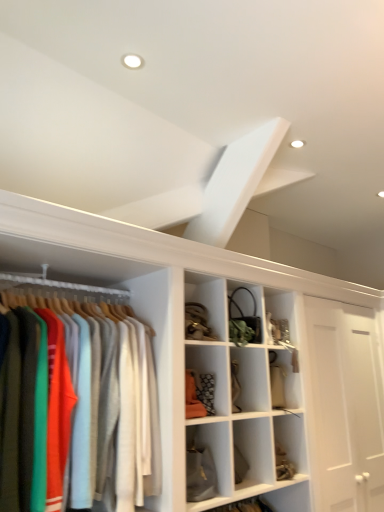
Find the location of a particular element. This screenshot has width=384, height=512. matte cotton shirts at left is located at coordinates (77, 406).

The width and height of the screenshot is (384, 512). Describe the element at coordinates (77, 406) in the screenshot. I see `matte cotton shirts at left` at that location.

What do you see at coordinates (235, 183) in the screenshot? I see `white matte exhaust hood at upper center` at bounding box center [235, 183].

Find the location of `white matte exhaust hood at upper center`. white matte exhaust hood at upper center is located at coordinates (235, 183).

You are a GUI agent. You are given a task and a screenshot of the screen. Output one action in this format:
    pyautogui.click(x=<x>, y=<y>)
    Task: Click on the matte cotton shirts at left
    Image resolution: width=384 pixels, height=512 pixels.
    Given the screenshot: What is the action you would take?
    pyautogui.click(x=77, y=406)

Can you confirm if white matte exhaust hood at upper center is positioned to the left of matte cotton shirts at left?

No, white matte exhaust hood at upper center is not to the left of matte cotton shirts at left.

Considering the positions of objects white matte exhaust hood at upper center and matte cotton shirts at left in the image provided, who is in front, white matte exhaust hood at upper center or matte cotton shirts at left?

matte cotton shirts at left is closer to the camera.

Which is farther from the camera, (246, 167) or (129, 361)?

The point (246, 167) is farther from the camera.

From the image's perspective, which is below, white matte exhaust hood at upper center or matte cotton shirts at left?

matte cotton shirts at left is shown below in the image.

From a real-world perspective, who is located lower, white matte exhaust hood at upper center or matte cotton shirts at left?

matte cotton shirts at left is physically lower.

Which object is thinner, white matte exhaust hood at upper center or matte cotton shirts at left?

With smaller width is white matte exhaust hood at upper center.

Which of these two, white matte exhaust hood at upper center or matte cotton shirts at left, stands shorter?

white matte exhaust hood at upper center is shorter.

Considering the sizes of objects white matte exhaust hood at upper center and matte cotton shirts at left in the image provided, who is bigger, white matte exhaust hood at upper center or matte cotton shirts at left?

Bigger between the two is matte cotton shirts at left.

In the scene shown: Do you think white matte exhaust hood at upper center is within matte cotton shirts at left, or outside of it?

white matte exhaust hood at upper center is not enclosed by matte cotton shirts at left.

Is white matte exhaust hood at upper center with matte cotton shirts at left?

No, white matte exhaust hood at upper center is not making contact with matte cotton shirts at left.

Could you tell me if white matte exhaust hood at upper center is turned towards matte cotton shirts at left?

No, white matte exhaust hood at upper center does not turn towards matte cotton shirts at left.

Measure the distance between white matte exhaust hood at upper center and matte cotton shirts at left.

white matte exhaust hood at upper center is 1.03 meters from matte cotton shirts at left.

Locate an element on the screen. The image size is (384, 512). clothing lying below the white matte exhaust hood at upper center (from the image's perspective) is located at coordinates (77, 406).

Is matte cotton shirts at left to the left or to the right of white matte exhaust hood at upper center in the image?

Based on their positions, matte cotton shirts at left is located to the left of white matte exhaust hood at upper center.

Does matte cotton shirts at left lie behind white matte exhaust hood at upper center?

No, matte cotton shirts at left is closer to the viewer.

Considering the positions of point (6, 438) and point (244, 197), is point (6, 438) closer or farther from the camera than point (244, 197)?

Point (6, 438) is positioned closer to the camera compared to point (244, 197).

From the image's perspective, which is above, matte cotton shirts at left or white matte exhaust hood at upper center?

From the image's view, white matte exhaust hood at upper center is above.

From a real-world perspective, between matte cotton shirts at left and white matte exhaust hood at upper center, who is vertically lower?

matte cotton shirts at left is physically lower.

Is matte cotton shirts at left thinner than white matte exhaust hood at upper center?

No, matte cotton shirts at left is not thinner than white matte exhaust hood at upper center.

Is matte cotton shirts at left taller or shorter than white matte exhaust hood at upper center?

Clearly, matte cotton shirts at left is taller compared to white matte exhaust hood at upper center.

In terms of size, does matte cotton shirts at left appear bigger or smaller than white matte exhaust hood at upper center?

In the image, matte cotton shirts at left appears to be larger than white matte exhaust hood at upper center.

Is matte cotton shirts at left outside of white matte exhaust hood at upper center?

Absolutely, matte cotton shirts at left is external to white matte exhaust hood at upper center.

Does matte cotton shirts at left touch white matte exhaust hood at upper center?

No, matte cotton shirts at left is not next to white matte exhaust hood at upper center.

Is matte cotton shirts at left looking in the opposite direction of white matte exhaust hood at upper center?

No, matte cotton shirts at left's orientation is not away from white matte exhaust hood at upper center.

Can you tell me how much matte cotton shirts at left and white matte exhaust hood at upper center differ in facing direction?

The angular difference between matte cotton shirts at left and white matte exhaust hood at upper center is 0.412 degrees.

Measure the distance between matte cotton shirts at left and white matte exhaust hood at upper center.

A distance of 1.03 meters exists between matte cotton shirts at left and white matte exhaust hood at upper center.

You are a GUI agent. You are given a task and a screenshot of the screen. Output one action in this format:
    pyautogui.click(x=<x>, y=<y>)
    Task: Click on the clothing below the white matte exhaust hood at upper center (from a real-world perspective)
    The width and height of the screenshot is (384, 512).
    Given the screenshot: What is the action you would take?
    pyautogui.click(x=77, y=406)

Locate an element on the screen. clothing directly beneath the white matte exhaust hood at upper center (from a real-world perspective) is located at coordinates (77, 406).

You are a GUI agent. You are given a task and a screenshot of the screen. Output one action in this format:
    pyautogui.click(x=<x>, y=<y>)
    Task: Click on the exhaust hood on the right of matte cotton shirts at left
    The image size is (384, 512).
    Given the screenshot: What is the action you would take?
    pyautogui.click(x=235, y=183)